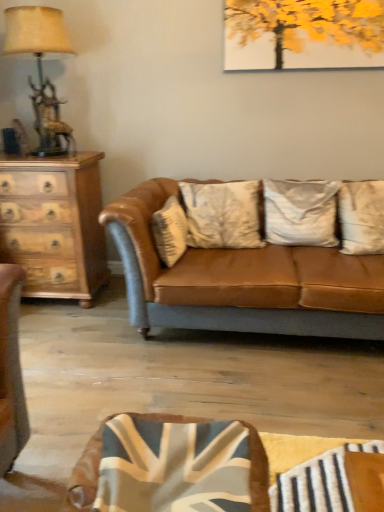
Question: Does silky white pillow at center, the third pillow positioned from the left, have a larger size compared to matte gold table lamp at left?

Choices:
 (A) yes
 (B) no

Answer: (B)

Question: From the image's perspective, is silky white pillow at center, which ranks as the 1th pillow in right-to-left order, located above matte gold table lamp at left?

Choices:
 (A) yes
 (B) no

Answer: (B)

Question: Is silky white pillow at center, which ranks as the 1th pillow in right-to-left order, positioned in front of matte gold table lamp at left?

Choices:
 (A) yes
 (B) no

Answer: (A)

Question: Is matte gold table lamp at left located within silky white pillow at center, the third pillow positioned from the left?

Choices:
 (A) no
 (B) yes

Answer: (A)

Question: Is silky white pillow at center, which ranks as the 1th pillow in right-to-left order, not close to matte gold table lamp at left?

Choices:
 (A) no
 (B) yes

Answer: (B)

Question: Can you confirm if silky white pillow at center, which ranks as the 1th pillow in right-to-left order, is taller than matte gold table lamp at left?

Choices:
 (A) yes
 (B) no

Answer: (B)

Question: From the image's perspective, would you say white textured pillow at center, the first pillow viewed from the left, is positioned over matte brown leather couch at center?

Choices:
 (A) no
 (B) yes

Answer: (B)

Question: Considering the relative sizes of white textured pillow at center, which is counted as the 3th pillow, starting from the right, and matte brown leather couch at center in the image provided, is white textured pillow at center, which is counted as the 3th pillow, starting from the right, thinner than matte brown leather couch at center?

Choices:
 (A) yes
 (B) no

Answer: (A)

Question: Is matte brown leather couch at center a part of white textured pillow at center, which is counted as the 3th pillow, starting from the right?

Choices:
 (A) yes
 (B) no

Answer: (B)

Question: Can you confirm if white textured pillow at center, which is counted as the 3th pillow, starting from the right, is positioned to the right of matte brown leather couch at center?

Choices:
 (A) yes
 (B) no

Answer: (B)

Question: Is white textured pillow at center, which is counted as the 3th pillow, starting from the right, touching matte brown leather couch at center?

Choices:
 (A) no
 (B) yes

Answer: (A)

Question: Is white textured pillow at center, the first pillow viewed from the left, wider than matte brown leather couch at center?

Choices:
 (A) yes
 (B) no

Answer: (B)

Question: From a real-world perspective, is matte gold table lamp at left beneath white textured pillow at center, the first pillow viewed from the left?

Choices:
 (A) no
 (B) yes

Answer: (A)